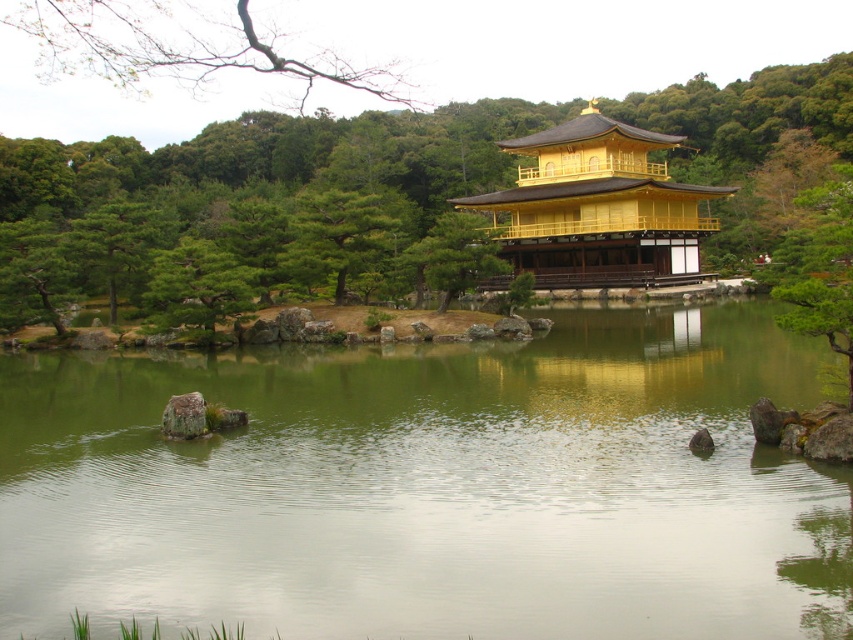
Question: Which point is closer to the camera?

Choices:
 (A) green textured tree at center
 (B) smooth gray rock at center

Answer: (B)

Question: Is green reflective water at center wider than green leafy tree at center?

Choices:
 (A) yes
 (B) no

Answer: (B)

Question: From the image, what is the correct spatial relationship of green textured tree at center in relation to smooth gray rock at center?

Choices:
 (A) left
 (B) right

Answer: (A)

Question: Is green reflective water at center further to the viewer compared to green textured tree at center?

Choices:
 (A) no
 (B) yes

Answer: (A)

Question: Among these objects, which one is nearest to the camera?

Choices:
 (A) bare branches at upper left
 (B) smooth gray rock at center
 (C) gold polished wood temple at center

Answer: (A)

Question: Which point appears closest to the camera in this image?

Choices:
 (A) [x=161, y=413]
 (B) [x=228, y=584]
 (C) [x=519, y=104]

Answer: (B)